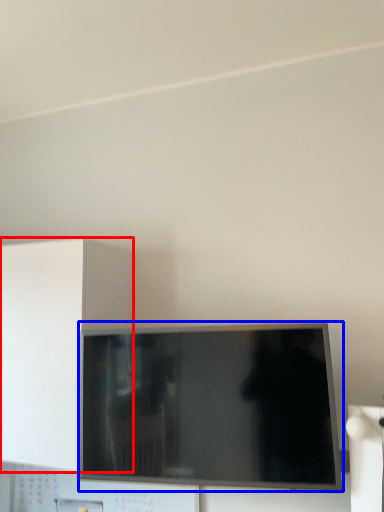
Question: Which object appears closest to the camera in this image, cabinetry (highlighted by a red box) or television (highlighted by a blue box)?

Choices:
 (A) cabinetry
 (B) television

Answer: (B)